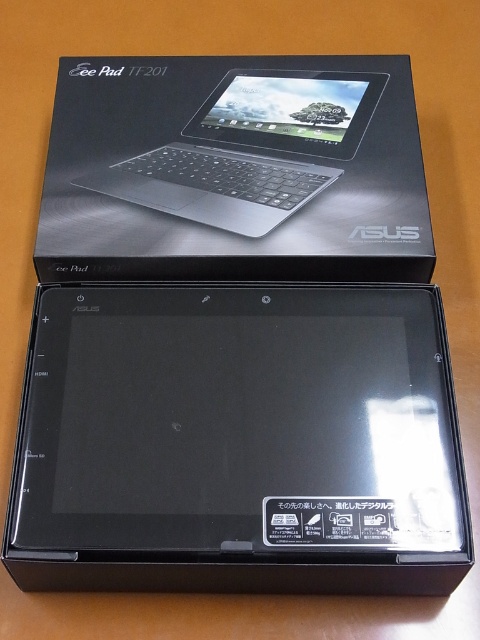
Which is behind, point (338, 308) or point (264, 70)?

Positioned behind is point (264, 70).

Is black glossy tablet at center shorter than satin black laptop at upper center?

In fact, black glossy tablet at center may be taller than satin black laptop at upper center.

In order to click on black glossy tablet at center in this screenshot , I will do `click(239, 442)`.